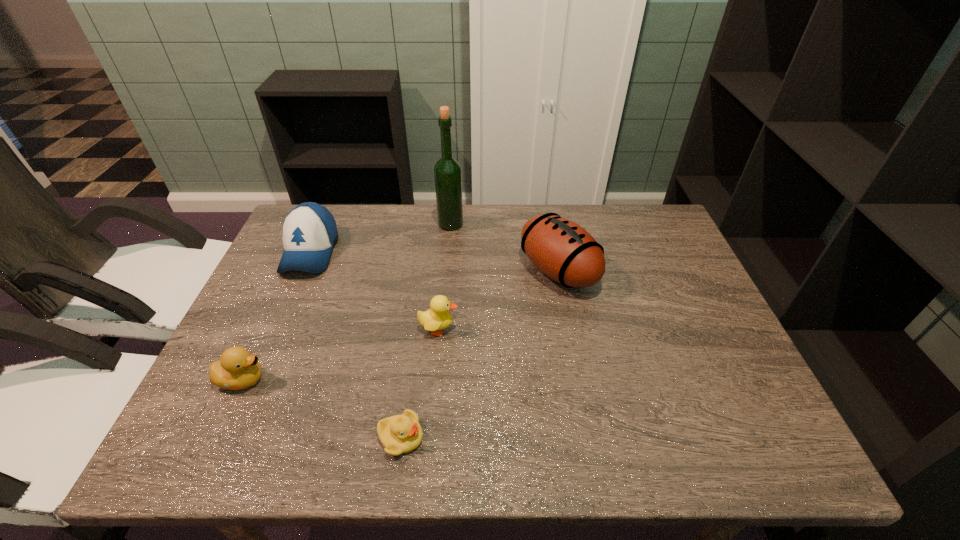
Identify the location of the tallest object. (448, 174).

Locate an element on the screen. This screenshot has width=960, height=540. the second tallest object is located at coordinates (561, 249).

Where is `the rightmost object`? This screenshot has width=960, height=540. the rightmost object is located at coordinates (561, 249).

Identify the location of the third tallest object. (309, 231).

The image size is (960, 540). What are the coordinates of `the farthest duckling` in the screenshot? It's located at (437, 318).

Identify the location of the leftmost duckling. The height and width of the screenshot is (540, 960). (238, 369).

Image resolution: width=960 pixels, height=540 pixels. I want to click on the second nearest object, so click(238, 369).

I want to click on the shortest duckling, so click(399, 434).

Find the location of a particular element. This screenshot has height=540, width=960. the nearest object is located at coordinates (399, 434).

Locate an element on the screen. free space located on the left of the liquor is located at coordinates click(x=363, y=225).